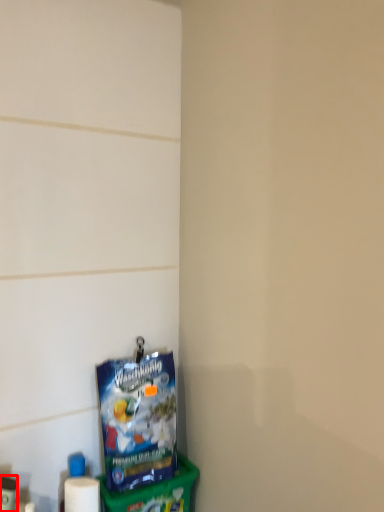
Question: From the image, what is the correct spatial relationship of toiletry (annotated by the red box) in relation to toy?

Choices:
 (A) left
 (B) right

Answer: (A)